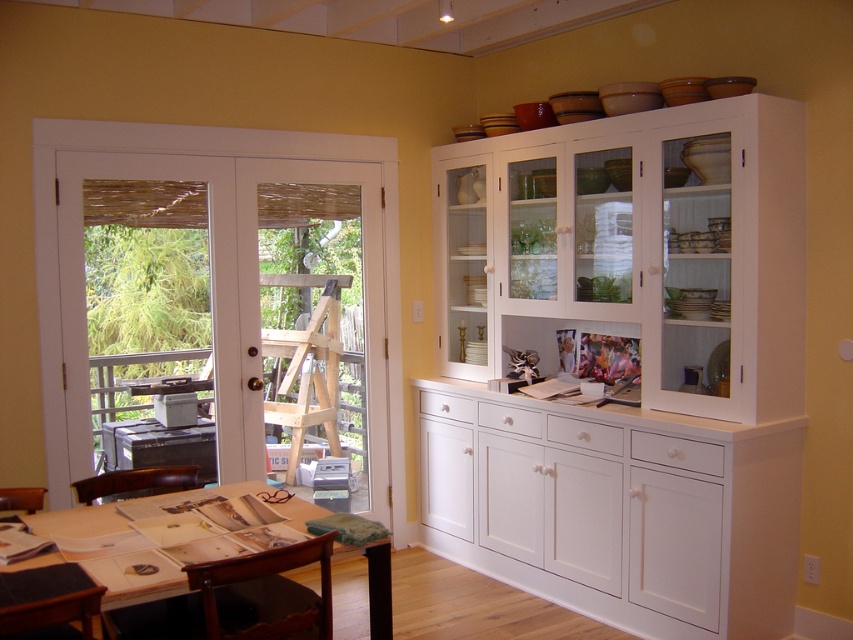
Does white glass door at left appear on the right side of wooden table at lower left?

In fact, white glass door at left is to the left of wooden table at lower left.

Is white glass door at left behind wooden table at lower left?

Yes, it is.

Between point (292, 240) and point (303, 502), which one is positioned in front?

Point (303, 502)

At what (x,y) coordinates should I click in order to perform the action: click on white glass door at left. Please return your answer as a coordinate pair (x, y). Image resolution: width=853 pixels, height=640 pixels. Looking at the image, I should click on (223, 308).